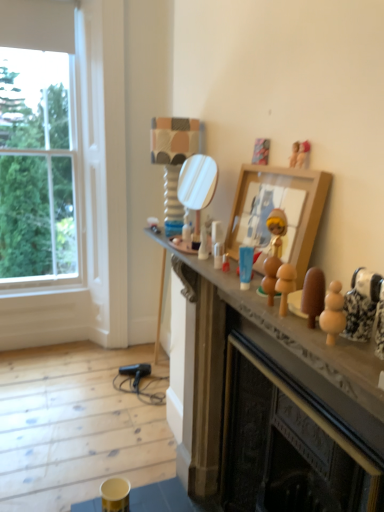
Question: From the image's perspective, is wooden picture frame at upper center located above or below porcelain figurine at right, the 5th toy when ordered from left to right?

Choices:
 (A) above
 (B) below

Answer: (A)

Question: In terms of height, does wooden picture frame at upper center look taller or shorter compared to porcelain figurine at right, which appears as the first toy when viewed from the front?

Choices:
 (A) tall
 (B) short

Answer: (A)

Question: Based on their relative distances, which object is nearer to the wooden toy at center, the second toy ordered from the bottom?

Choices:
 (A) clear glass window at left
 (B) wooden picture frame at upper center
 (C) translucent plastic container at center, which is the first toy in back-to-front order
 (D) porcelain figurine at right, placed as the 5th toy when sorted from top to bottom
 (E) wooden figurines at center

Answer: (B)

Question: Which is farther from the wooden figurine at upper center, which appears as the 3th toy when viewed from the left?

Choices:
 (A) wooden doll at upper right, the second toy when ordered from top to bottom
 (B) wooden toy at center, marked as the 2th toy in a front-to-back arrangement
 (C) wooden figurines at center
 (D) wooden picture frame at upper center
 (E) porcelain figurine at right, the 1th toy in the right-to-left sequence

Answer: (C)